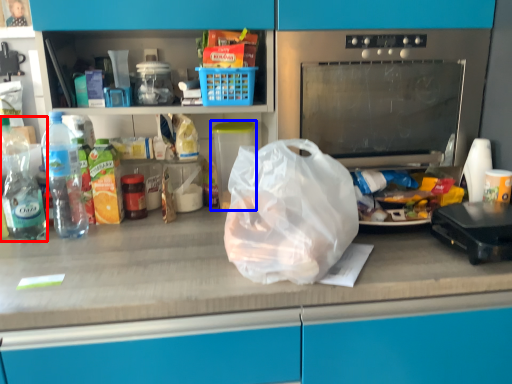
Question: Among these objects, which one is nearest to the camera, bottle (highlighted by a red box) or appliance (highlighted by a blue box)?

Choices:
 (A) bottle
 (B) appliance

Answer: (A)